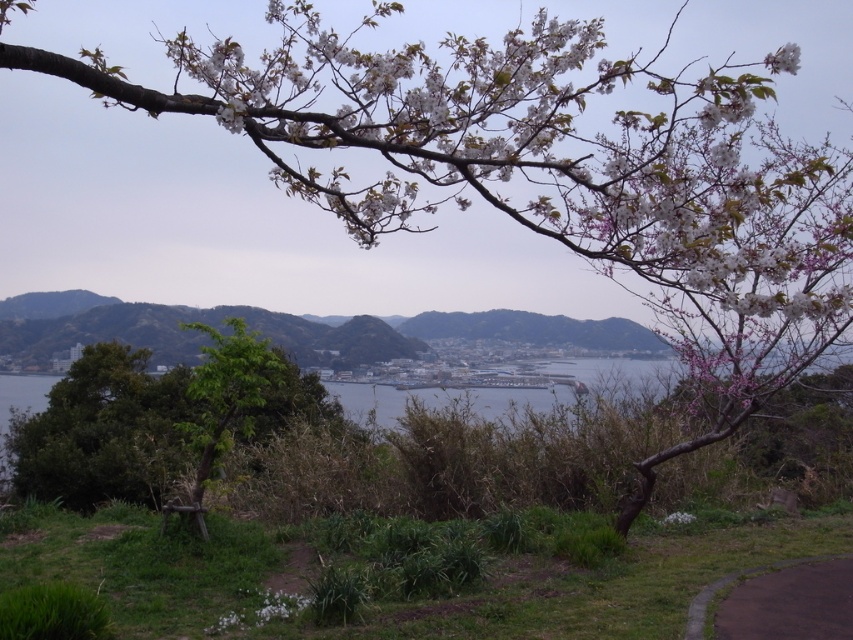
Question: Based on their relative distances, which object is nearer to the white matte flower at upper right?

Choices:
 (A) paved asphalt path at lower right
 (B) green leafy tree at center

Answer: (A)

Question: Considering the relative positions of paved asphalt path at lower right and white matte flower at upper right in the image provided, where is paved asphalt path at lower right located with respect to white matte flower at upper right?

Choices:
 (A) right
 (B) left

Answer: (B)

Question: Does green leafy tree at center come in front of paved asphalt path at lower right?

Choices:
 (A) no
 (B) yes

Answer: (A)

Question: Which object is the farthest from the green leafy tree at center?

Choices:
 (A) paved asphalt path at lower right
 (B) white matte flower at upper right

Answer: (B)

Question: Which point appears farthest from the camera in this image?

Choices:
 (A) (788, 42)
 (B) (701, 627)
 (C) (54, 406)

Answer: (A)

Question: Is green leafy tree at center wider than paved asphalt path at lower right?

Choices:
 (A) yes
 (B) no

Answer: (A)